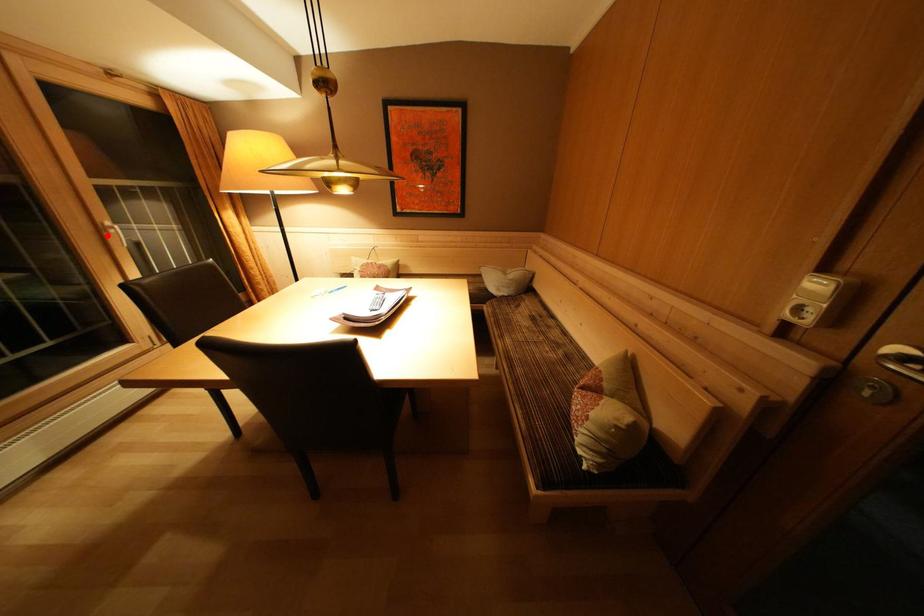
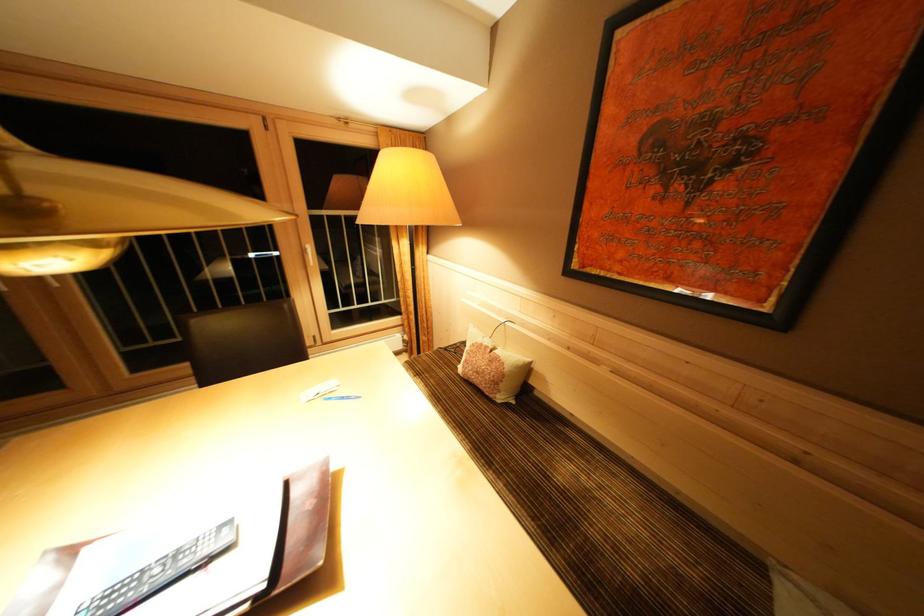
Question: I am providing you with two images of the same scene from different viewpoints. In image1, a red point is highlighted. Considering the same 3D point in image2, which of the following is correct?

Choices:
 (A) It is closer
 (B) It is farther

Answer: (A)